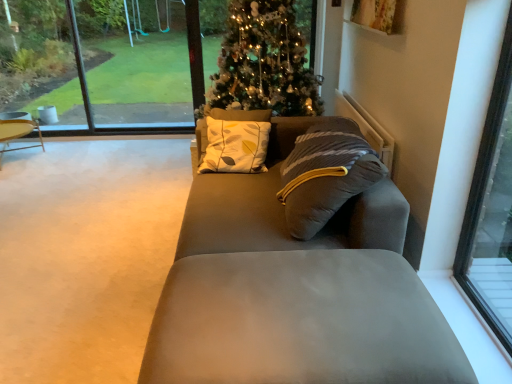
Question: Relative to suede gray couch at center, is transparent glass window at right, the first window positioned from the right, in front or behind?

Choices:
 (A) behind
 (B) front

Answer: (B)

Question: From a real-world perspective, relative to suede gray couch at center, is transparent glass window at right, the 1th window when ordered from front to back, vertically above or below?

Choices:
 (A) above
 (B) below

Answer: (A)

Question: Which object is the farthest from the iridescent glass christmas tree at center?

Choices:
 (A) suede-like gray footrest at lower center
 (B) transparent glass window at upper left
 (C) transparent glass window at upper center, positioned as the 2th window in front-to-back order
 (D) wooden round table at left
 (E) suede gray couch at center

Answer: (D)

Question: Which is nearer to the suede gray couch at center?

Choices:
 (A) wooden round table at left
 (B) iridescent glass christmas tree at center
 (C) transparent glass window at upper left
 (D) suede-like gray footrest at lower center
 (E) transparent glass window at upper center, which is the 1th window in back-to-front order

Answer: (D)